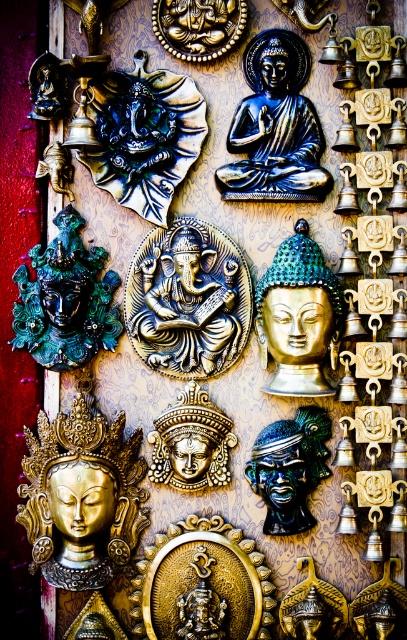
Question: Based on their relative distances, which object is farther from the gold metallic mask at center?

Choices:
 (A) gold metallic ganesh at center
 (B) gold metallic bell at center
 (C) green glossy buddha head at center

Answer: (B)

Question: Does black polished buddha at center have a greater width compared to teal glossy mask at left?

Choices:
 (A) no
 (B) yes

Answer: (A)

Question: Which of the following is the closest to the observer?

Choices:
 (A) (89, 99)
 (B) (323, 188)
 (C) (315, 337)
 (D) (54, 282)

Answer: (C)

Question: Can you confirm if gold polished buddha at lower left is bigger than gold metallic bell at center?

Choices:
 (A) no
 (B) yes

Answer: (B)

Question: Is black polished buddha at center above gold metallic mask at center?

Choices:
 (A) no
 (B) yes

Answer: (B)

Question: Which object appears closest to the camera in this image?

Choices:
 (A) gold polished statue at center
 (B) gold metallic ganesh at center

Answer: (A)